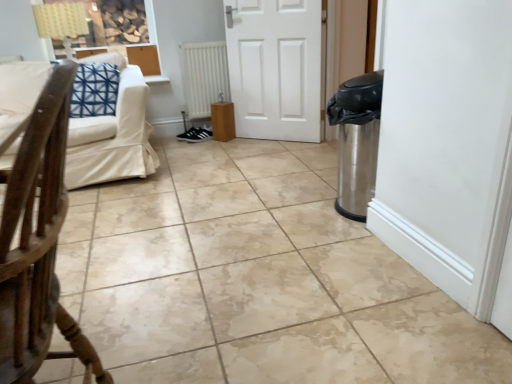
Locate an element on the screen. vacant space that is to the left of black suede sneakers at center is located at coordinates (164, 140).